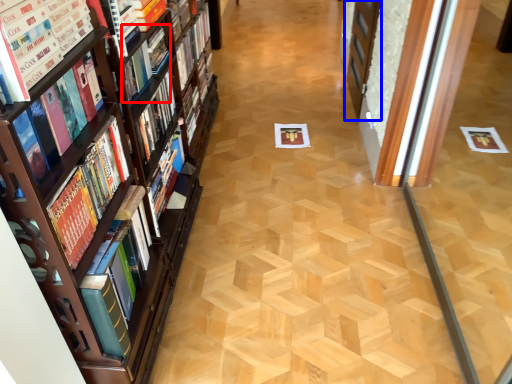
Question: Which object appears farthest to the camera in this image, book (highlighted by a red box) or screen door (highlighted by a blue box)?

Choices:
 (A) book
 (B) screen door

Answer: (B)